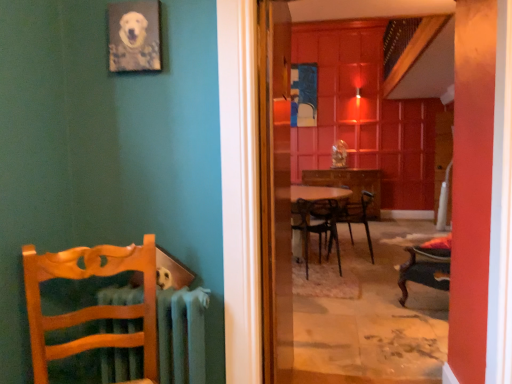
Measure the distance between point (112, 71) and camera.

5.32 feet.

What do you see at coordinates (134, 36) in the screenshot? This screenshot has height=384, width=512. I see `wooden picture frame at upper left` at bounding box center [134, 36].

Image resolution: width=512 pixels, height=384 pixels. What do you see at coordinates (357, 216) in the screenshot? I see `metallic black chair at center, the 1th chair positioned from the back` at bounding box center [357, 216].

How much space does metallic black chair at center, which appears as the third chair when viewed from the front, occupy vertically?

The height of metallic black chair at center, which appears as the third chair when viewed from the front, is 31.48 inches.

Image resolution: width=512 pixels, height=384 pixels. What do you see at coordinates (317, 225) in the screenshot?
I see `wooden chair at center, arranged as the 2th chair when viewed from the right` at bounding box center [317, 225].

The image size is (512, 384). What do you see at coordinates (350, 184) in the screenshot? I see `wooden table at center` at bounding box center [350, 184].

Find the location of a particular element. metallic radiator at left is located at coordinates (181, 334).

Is wooden chair at center, the 2th chair positioned from the left, positioned with its back to metallic black chair at center, acting as the third chair starting from the left?

That's not correct — wooden chair at center, the 2th chair positioned from the left, is not looking away from metallic black chair at center, acting as the third chair starting from the left.

Which of these two, wooden chair at center, the 2th chair in the back-to-front sequence, or metallic black chair at center, the 1th chair positioned from the back, is bigger?

metallic black chair at center, the 1th chair positioned from the back, is bigger.

Consider the image. Is wooden chair at center, the 2th chair from the front, not within metallic black chair at center, which appears as the third chair when viewed from the front?

Yes, wooden chair at center, the 2th chair from the front, is located beyond the bounds of metallic black chair at center, which appears as the third chair when viewed from the front.

At what (x,y) coordinates should I click in order to perform the action: click on chair above the wooden chair at center, the 2th chair from the front (from the image's perspective). Please return your answer as a coordinate pair (x, y). The width and height of the screenshot is (512, 384). Looking at the image, I should click on (357, 216).

This screenshot has height=384, width=512. What are the coordinates of `the 1st screen door to the right when counting from the wooden picture frame at upper left` in the screenshot? It's located at (275, 188).

From a real-world perspective, is wooden picture frame at upper left physically above transparent glass screen door at center, arranged as the first screen door when viewed from the back?

Indeed, from a real-world perspective, wooden picture frame at upper left stands above transparent glass screen door at center, arranged as the first screen door when viewed from the back.

Is wooden picture frame at upper left bigger or smaller than transparent glass screen door at center, arranged as the first screen door when viewed from the back?

Considering their sizes, wooden picture frame at upper left takes up less space than transparent glass screen door at center, arranged as the first screen door when viewed from the back.

The height and width of the screenshot is (384, 512). I want to click on picture frame that is above the wooden chair at left, the first chair when ordered from front to back (from a real-world perspective), so click(134, 36).

From a real-world perspective, who is located higher, wooden chair at left, the first chair when ordered from front to back, or wooden picture frame at upper left?

In real-world perspective, wooden picture frame at upper left is above.

Considering the sizes of objects wooden chair at left, which is the 1th chair in left-to-right order, and wooden picture frame at upper left in the image provided, who is bigger, wooden chair at left, which is the 1th chair in left-to-right order, or wooden picture frame at upper left?

With larger size is wooden chair at left, which is the 1th chair in left-to-right order.

Which of these two, wooden chair at left, which is the 1th chair in left-to-right order, or wooden picture frame at upper left, stands taller?

wooden chair at left, which is the 1th chair in left-to-right order.

Which of these two, metallic black chair at center, the 1th chair positioned from the back, or wooden picture frame at upper left, stands shorter?

With less height is wooden picture frame at upper left.

Is wooden picture frame at upper left at the back of metallic black chair at center, positioned as the first chair in right-to-left order?

metallic black chair at center, positioned as the first chair in right-to-left order, is not turned away from wooden picture frame at upper left.

How many degrees apart are the facing directions of metallic black chair at center, which appears as the third chair when viewed from the front, and wooden picture frame at upper left?

They differ by 92.9 degrees in their facing directions.

From the image's perspective, does metallic black chair at center, which appears as the third chair when viewed from the front, appear lower than wooden picture frame at upper left?

Indeed, from the image's perspective, metallic black chair at center, which appears as the third chair when viewed from the front, is shown beneath wooden picture frame at upper left.

From the image's perspective, relative to wooden picture frame at upper left, is wooden table at center above or below?

Based on their image positions, wooden table at center is located beneath wooden picture frame at upper left.

The image size is (512, 384). What are the coordinates of `desk behind the wooden picture frame at upper left` in the screenshot? It's located at (350, 184).

Is wooden table at center not near wooden picture frame at upper left?

Yes, wooden table at center is far from wooden picture frame at upper left.

Can you confirm if wooden table at center is shorter than wooden picture frame at upper left?

No, wooden table at center is not shorter than wooden picture frame at upper left.

Is metallic black chair at center, which appears as the third chair when viewed from the front, at the left side of wooden chair at left, the third chair positioned from the back?

In fact, metallic black chair at center, which appears as the third chair when viewed from the front, is to the right of wooden chair at left, the third chair positioned from the back.

Can you confirm if metallic black chair at center, which appears as the third chair when viewed from the front, is thinner than wooden chair at left, which is counted as the 3th chair, starting from the right?

No.

Does point (340, 222) lie behind point (105, 271)?

Yes, point (340, 222) is behind point (105, 271).

Is wooden table at center far away from metallic radiator at left?

Yes, wooden table at center is far from metallic radiator at left.

Considering the relative sizes of wooden table at center and metallic radiator at left in the image provided, is wooden table at center taller than metallic radiator at left?

Indeed, wooden table at center has a greater height compared to metallic radiator at left.

Is wooden table at center not within metallic radiator at left?

Yes, wooden table at center is located beyond the bounds of metallic radiator at left.

Identify the location of radiator on the left of wooden table at center. The height and width of the screenshot is (384, 512). (181, 334).

From the image's perspective, count 1st chairs downward from the metallic black chair at center, the 1th chair positioned from the back, and point to it. Please provide its 2D coordinates.

[(317, 225)]

Image resolution: width=512 pixels, height=384 pixels. In order to click on picture frame above the transparent glass screen door at center, positioned as the second screen door in front-to-back order (from a real-world perspective) in this screenshot , I will do `click(134, 36)`.

Looking at the image, which one is located further to metallic radiator at left, wooden chair at center, the 2th chair from the front, or transparent glass screen door at center, which ranks as the first screen door in front-to-back order?

transparent glass screen door at center, which ranks as the first screen door in front-to-back order.

Considering their positions, is metallic black chair at center, acting as the third chair starting from the left, positioned further to wooden chair at left, which is the 1th chair in left-to-right order, than transparent glass screen door at center, placed as the 2th screen door when sorted from back to front?

The object further to wooden chair at left, which is the 1th chair in left-to-right order, is transparent glass screen door at center, placed as the 2th screen door when sorted from back to front.

Based on their spatial positions, is wooden chair at center, arranged as the 2th chair when viewed from the right, or wooden picture frame at upper left further from metallic black chair at center, the 1th chair positioned from the back?

wooden picture frame at upper left is positioned further to the anchor metallic black chair at center, the 1th chair positioned from the back.

When comparing their distances from wooden chair at left, which is the 1th chair in left-to-right order, does wooden chair at center, the 2th chair from the front, or metallic radiator at left seem further?

Based on the image, wooden chair at center, the 2th chair from the front, appears to be further to wooden chair at left, which is the 1th chair in left-to-right order.

Looking at the image, which one is located further to wooden chair at center, the 2th chair positioned from the left, transparent glass screen door at center, positioned as the second screen door in front-to-back order, or wooden chair at left, which is the 1th chair in left-to-right order?

wooden chair at left, which is the 1th chair in left-to-right order, is further to wooden chair at center, the 2th chair positioned from the left.

Estimate the real-world distances between objects in this image. Which object is further from wooden chair at center, the 2th chair from the front, transparent glass screen door at center, which ranks as the first screen door in front-to-back order, or metallic radiator at left?

metallic radiator at left lies further to wooden chair at center, the 2th chair from the front, than the other object.

From the image, which object appears to be farther from wooden chair at left, which is counted as the 3th chair, starting from the right, wooden picture frame at upper left or wooden chair at center, arranged as the 2th chair when viewed from the right?

wooden chair at center, arranged as the 2th chair when viewed from the right.

When comparing their distances from wooden chair at center, the 2th chair positioned from the left, does transparent glass screen door at center, placed as the 2th screen door when sorted from back to front, or wooden table at center seem further?

transparent glass screen door at center, placed as the 2th screen door when sorted from back to front, lies further to wooden chair at center, the 2th chair positioned from the left, than the other object.

Where is `screen door between metallic radiator at left and wooden table at center in the front-back direction`? This screenshot has width=512, height=384. screen door between metallic radiator at left and wooden table at center in the front-back direction is located at coordinates (275, 188).

Identify the location of chair between metallic radiator at left and metallic black chair at center, positioned as the first chair in right-to-left order, in the front-back direction. (317, 225).

Locate an element on the screen. The height and width of the screenshot is (384, 512). picture frame between transparent glass screen door at center, which ranks as the first screen door in front-to-back order, and metallic black chair at center, positioned as the first chair in right-to-left order, in the front-back direction is located at coordinates (134, 36).

I want to click on picture frame positioned between wooden chair at left, the third chair positioned from the back, and wooden table at center from near to far, so (134, 36).